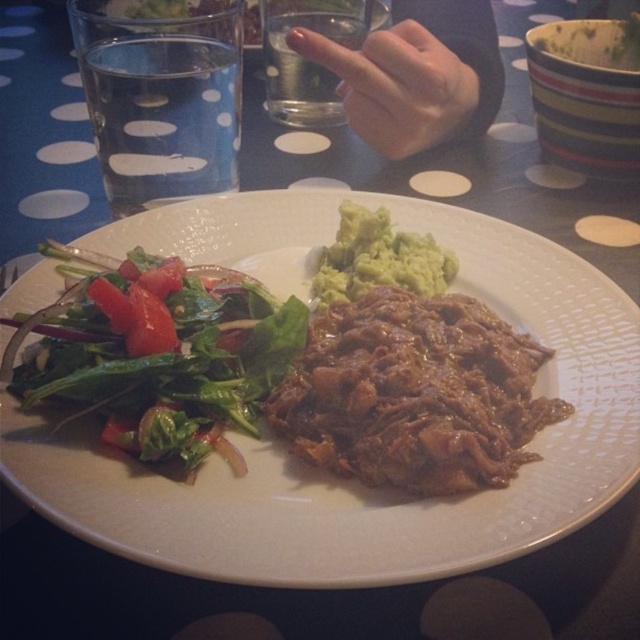
Question: Which point is closer to the camera?

Choices:
 (A) (346, 202)
 (B) (154, 358)

Answer: (B)

Question: Does green leafymaterial/texturesalad at left have a larger size compared to green creamy guacamole at center?

Choices:
 (A) yes
 (B) no

Answer: (A)

Question: Which point appears farthest from the camera in this image?

Choices:
 (A) (67, 339)
 (B) (324, 284)

Answer: (B)

Question: Can you confirm if white matte plate at center is bigger than brown glossy shredded beef at center?

Choices:
 (A) no
 (B) yes

Answer: (B)

Question: Does white matte plate at center have a smaller size compared to brown glossy shredded beef at center?

Choices:
 (A) yes
 (B) no

Answer: (B)

Question: Which point is farther to the camera?

Choices:
 (A) [376, 476]
 (B) [572, 292]
 (C) [236, 291]

Answer: (B)